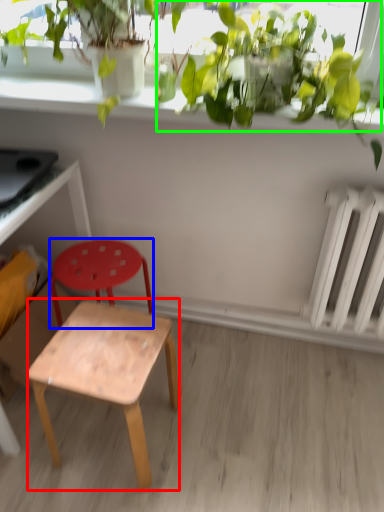
Question: Estimate the real-world distances between objects in this image. Which object is farther from stool (highlighted by a red box), stool (highlighted by a blue box) or vegetation (highlighted by a green box)?

Choices:
 (A) stool
 (B) vegetation

Answer: (B)